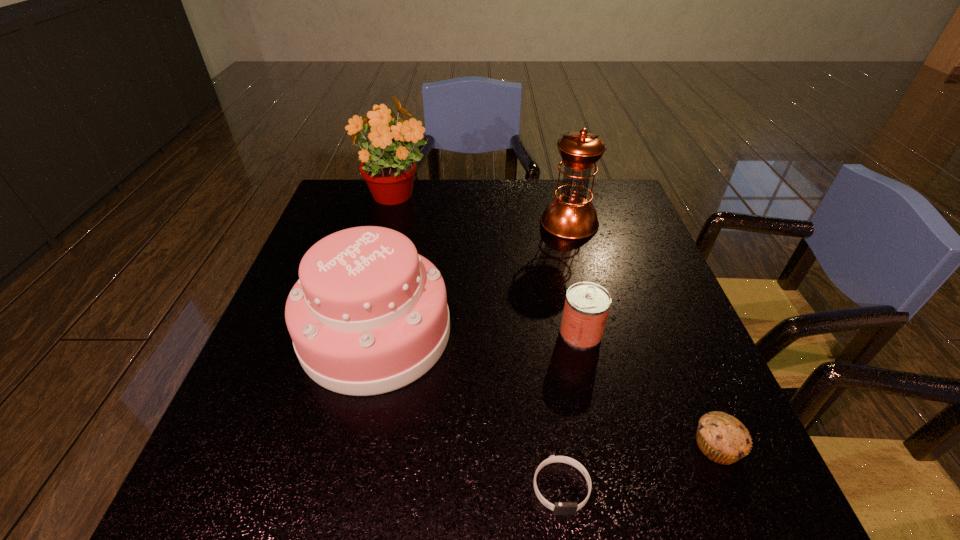
Where is `the third closest object relative to the birthday cake`? This screenshot has height=540, width=960. the third closest object relative to the birthday cake is located at coordinates (389, 168).

The width and height of the screenshot is (960, 540). I want to click on the fifth closest object to the shortest object, so click(389, 168).

At what (x,y) coordinates should I click in order to perform the action: click on free location that satisfies the following two spatial constraints: 1. on the front side of the fourth tallest object; 2. on the right side of the birthday cake. Please return your answer as a coordinate pair (x, y). The height and width of the screenshot is (540, 960). Looking at the image, I should click on (375, 333).